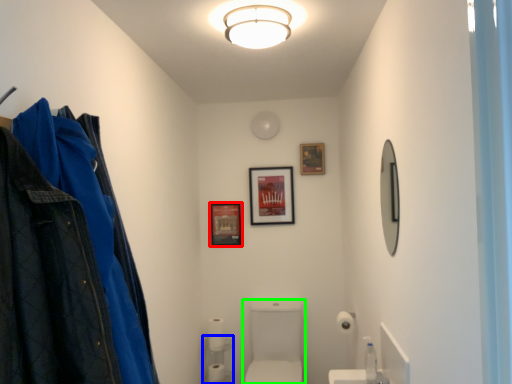
Question: Estimate the real-world distances between objects in this image. Which object is farther from picture frame (highlighted by a red box), shelf (highlighted by a blue box) or sink (highlighted by a green box)?

Choices:
 (A) shelf
 (B) sink

Answer: (A)